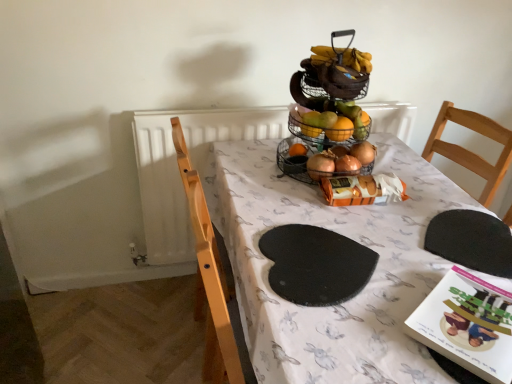
Question: Can you confirm if white paper book at lower right is smaller than black felt mat at center, which ranks as the second mat in right-to-left order?

Choices:
 (A) yes
 (B) no

Answer: (A)

Question: Are white paper book at lower right and black felt mat at center, which ranks as the first mat in left-to-right order, located far from each other?

Choices:
 (A) no
 (B) yes

Answer: (A)

Question: Can you confirm if white paper book at lower right is positioned to the left of black felt mat at center, which ranks as the first mat in left-to-right order?

Choices:
 (A) yes
 (B) no

Answer: (B)

Question: Is white paper book at lower right positioned before black felt mat at center, which ranks as the second mat in right-to-left order?

Choices:
 (A) no
 (B) yes

Answer: (B)

Question: Is black felt mat at center, which ranks as the second mat in right-to-left order, located within white paper book at lower right?

Choices:
 (A) no
 (B) yes

Answer: (A)

Question: Is white paper book at lower right facing towards black felt mat at center, which ranks as the second mat in right-to-left order?

Choices:
 (A) yes
 (B) no

Answer: (B)

Question: From a real-world perspective, is wire mesh basket at center beneath black felt mat at center, which ranks as the first mat in left-to-right order?

Choices:
 (A) yes
 (B) no

Answer: (B)

Question: Does wire mesh basket at center have a larger size compared to black felt mat at center, which ranks as the first mat in left-to-right order?

Choices:
 (A) no
 (B) yes

Answer: (B)

Question: Is wire mesh basket at center thinner than black felt mat at center, which ranks as the second mat in right-to-left order?

Choices:
 (A) no
 (B) yes

Answer: (B)

Question: Is the surface of wire mesh basket at center in direct contact with black felt mat at center, which ranks as the first mat in left-to-right order?

Choices:
 (A) yes
 (B) no

Answer: (B)

Question: From the image's perspective, is wire mesh basket at center below black felt mat at center, which ranks as the second mat in right-to-left order?

Choices:
 (A) yes
 (B) no

Answer: (B)

Question: Is there a large distance between wire mesh basket at center and black felt mat at center, which ranks as the second mat in right-to-left order?

Choices:
 (A) yes
 (B) no

Answer: (B)

Question: Is black rubber placemat at lower right, which is counted as the first mat, starting from the right, shorter than white fabric table at center?

Choices:
 (A) yes
 (B) no

Answer: (A)